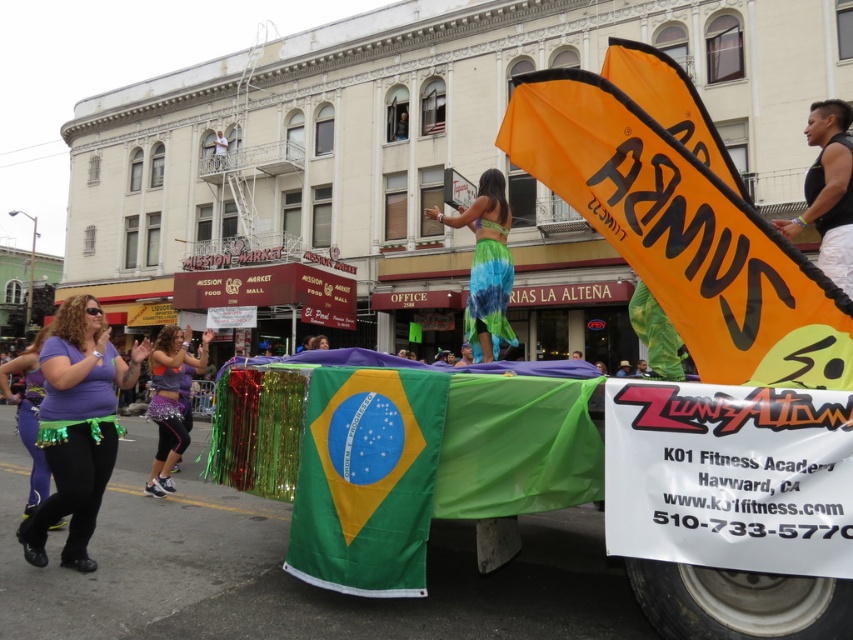
You are a photographer trying to capture the orange fabric flag at upper right and purple fabric skirt at lower left in a single frame. Based on their positions, which object will appear larger in your photo?

The orange fabric flag at upper right is closer to the viewer than the purple fabric skirt at lower left, so it will appear larger in the photo.